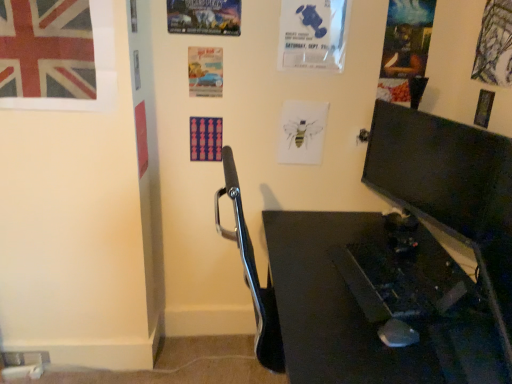
Question: Does watercolor bee at center, the fourth poster page positioned from the right, have a greater height compared to black glossy desk at lower right?

Choices:
 (A) no
 (B) yes

Answer: (A)

Question: Is watercolor bee at center, the fourth poster page positioned from the right, to the right of black glossy desk at lower right from the viewer's perspective?

Choices:
 (A) no
 (B) yes

Answer: (A)

Question: Considering the relative sizes of watercolor bee at center, the fourth poster page positioned from the right, and black glossy desk at lower right in the image provided, is watercolor bee at center, the fourth poster page positioned from the right, smaller than black glossy desk at lower right?

Choices:
 (A) yes
 (B) no

Answer: (A)

Question: From the image's perspective, is watercolor bee at center, which is the third poster page in left-to-right order, on black glossy desk at lower right?

Choices:
 (A) yes
 (B) no

Answer: (A)

Question: From a real-world perspective, is watercolor bee at center, which is the third poster page in left-to-right order, under black glossy desk at lower right?

Choices:
 (A) no
 (B) yes

Answer: (A)

Question: From the image's perspective, is matte black monitor at right located above or below oil painting portrait at upper right, the fifth poster page positioned from the left?

Choices:
 (A) below
 (B) above

Answer: (A)

Question: Choose the correct answer: Is matte black monitor at right inside oil painting portrait at upper right, the fifth poster page positioned from the left, or outside it?

Choices:
 (A) inside
 (B) outside

Answer: (B)

Question: Is matte black monitor at right to the left or to the right of oil painting portrait at upper right, the fifth poster page positioned from the left, in the image?

Choices:
 (A) left
 (B) right

Answer: (A)

Question: Is matte black monitor at right in front of or behind oil painting portrait at upper right, the fifth poster page positioned from the left, in the image?

Choices:
 (A) front
 (B) behind

Answer: (A)

Question: Is point (307, 142) closer or farther from the camera than point (209, 64)?

Choices:
 (A) farther
 (B) closer

Answer: (A)

Question: From their relative heights in the image, would you say watercolor bee at center, which is the third poster page in left-to-right order, is taller or shorter than matte paper poster at center, the sixth poster page viewed from the right?

Choices:
 (A) tall
 (B) short

Answer: (A)

Question: From a real-world perspective, is watercolor bee at center, which is the third poster page in left-to-right order, positioned above or below matte paper poster at center, the 1th poster page when ordered from left to right?

Choices:
 (A) below
 (B) above

Answer: (A)

Question: From the image's perspective, is watercolor bee at center, the fourth poster page positioned from the right, positioned above or below matte paper poster at center, the 1th poster page when ordered from left to right?

Choices:
 (A) below
 (B) above

Answer: (A)

Question: Considering the positions of metallic poster at upper center, the second poster page positioned from the left, and oil painting portrait at upper right, the fifth poster page positioned from the left, in the image, is metallic poster at upper center, the second poster page positioned from the left, taller or shorter than oil painting portrait at upper right, the fifth poster page positioned from the left,?

Choices:
 (A) tall
 (B) short

Answer: (B)

Question: Considering their positions, is metallic poster at upper center, the second poster page positioned from the left, located in front of or behind oil painting portrait at upper right, the fifth poster page positioned from the left?

Choices:
 (A) behind
 (B) front

Answer: (B)